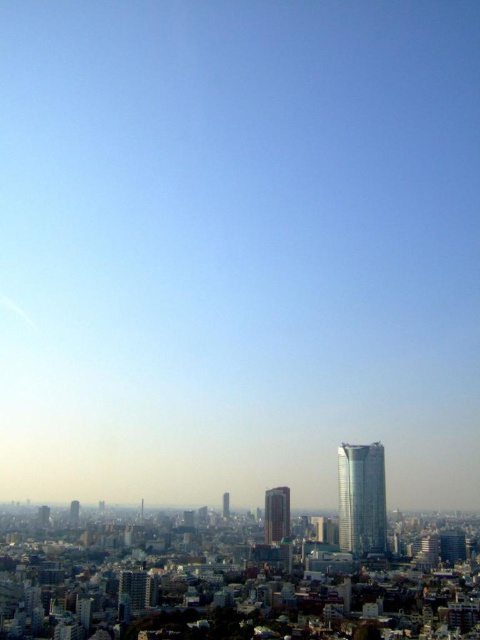
Does silver metallic tower at right have a smaller size compared to smooth glass skyscraper at center?

No, silver metallic tower at right is not smaller than smooth glass skyscraper at center.

The width and height of the screenshot is (480, 640). What do you see at coordinates (361, 499) in the screenshot? I see `silver metallic tower at right` at bounding box center [361, 499].

Identify the location of silver metallic tower at right. This screenshot has height=640, width=480. (361, 499).

I want to click on silver metallic tower at right, so click(x=361, y=499).

Can you confirm if smooth glass skyscraper at center is positioned below matte gray skyscraper at lower left?

No, smooth glass skyscraper at center is not below matte gray skyscraper at lower left.

Is point (286, 538) behind point (71, 515)?

No, (286, 538) is in front of (71, 515).

This screenshot has width=480, height=640. I want to click on smooth glass skyscraper at center, so coord(276,515).

Is point (280, 529) more distant than point (228, 509)?

Yes, it is behind point (228, 509).

Between point (267, 531) and point (226, 502), which one is positioned behind?

Positioned behind is point (267, 531).

Is point (269, 513) positioned in front of point (224, 516)?

That is True.

Find the location of a particular element. smooth glass skyscraper at center is located at coordinates (276, 515).